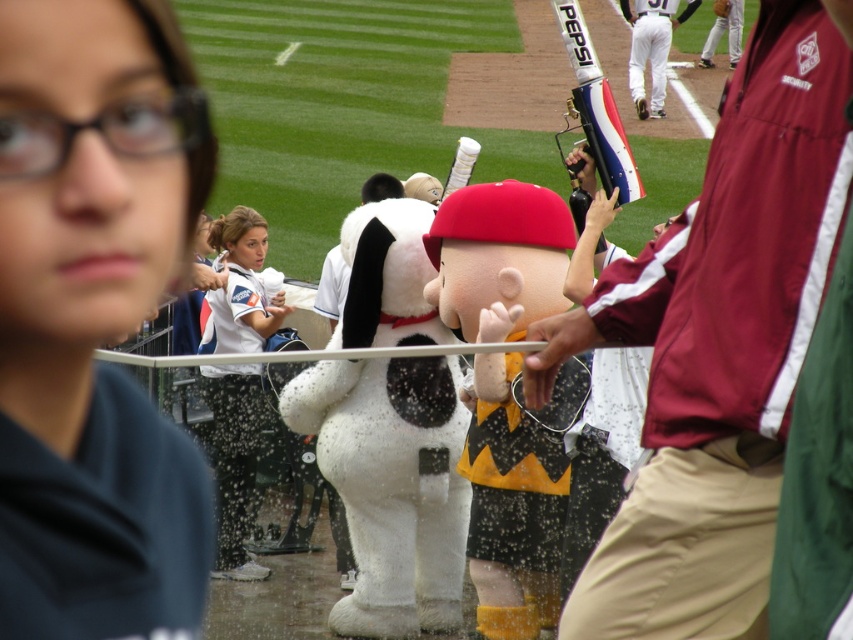
You are a photographer at the baseball stadium. You see the white plush dog at center and the white fabric shirt at center in your frame. Which object should you zoom in on to capture more details of the smaller one?

The white plush dog at center is smaller than the white fabric shirt at center, so you should zoom in on the white plush dog at center to capture more details of the smaller one.

You are a photographer trying to capture the maroon security jacket at center and the white plush dog at center in the same frame. Based on their positions, which object is closer to the camera?

The maroon security jacket at center is above the white plush dog at center, so the white plush dog at center is closer to the camera since it is positioned lower in the frame.